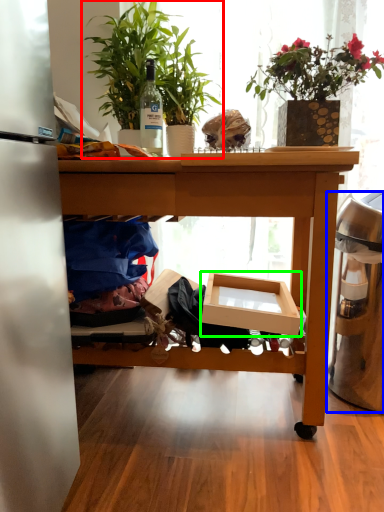
Question: Which object is the closest to the houseplant (highlighted by a red box)? Choose among these: trash bin/can (highlighted by a blue box) or cardboard box (highlighted by a green box).

Choices:
 (A) trash bin/can
 (B) cardboard box

Answer: (B)